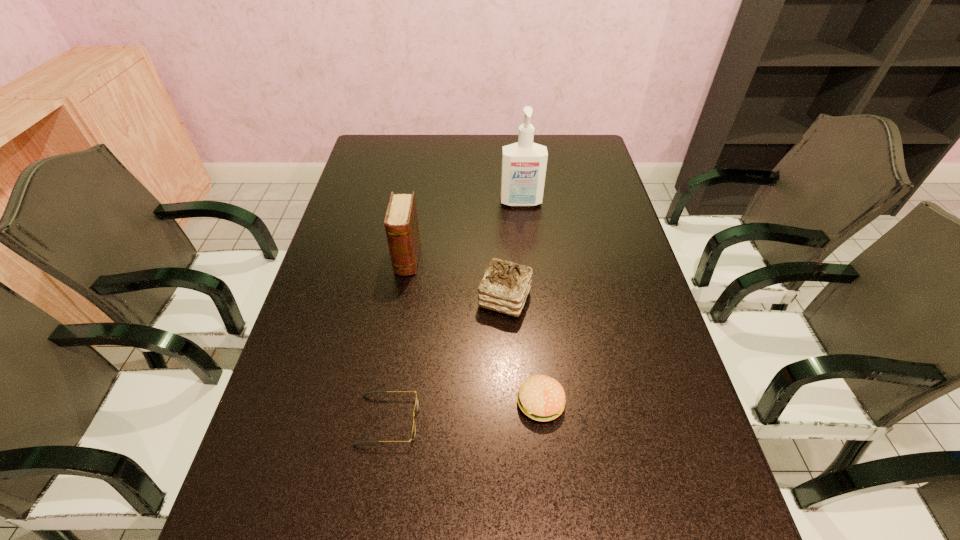
Locate an element on the screen. vacant space positioned on the front of the third nearest object is located at coordinates (507, 350).

Where is `vacant area situated on the right of the patty`? The image size is (960, 540). vacant area situated on the right of the patty is located at coordinates (588, 403).

Where is `vacant space located 0.100m on the front-facing side of the sunglasses`? vacant space located 0.100m on the front-facing side of the sunglasses is located at coordinates (466, 420).

The width and height of the screenshot is (960, 540). In the image, there is a desktop. Identify the location of vacant area at the far edge. (507, 134).

In the image, there is a desktop. Where is `free space at the left edge`? Image resolution: width=960 pixels, height=540 pixels. free space at the left edge is located at coordinates (276, 474).

Locate an element on the screen. The image size is (960, 540). blank space at the right edge of the desktop is located at coordinates (588, 180).

In the image, there is a desktop. Where is `vacant space at the far left corner`? The width and height of the screenshot is (960, 540). vacant space at the far left corner is located at coordinates (370, 163).

Where is `free spot between the fourth shortest object and the patty`? free spot between the fourth shortest object and the patty is located at coordinates (474, 330).

At what (x,y) coordinates should I click in order to perform the action: click on vacant space that's between the diary and the patty. Please return your answer as a coordinate pair (x, y). Looking at the image, I should click on (474, 330).

Locate an element on the screen. The height and width of the screenshot is (540, 960). vacant area that lies between the fourth shortest object and the patty is located at coordinates (474, 330).